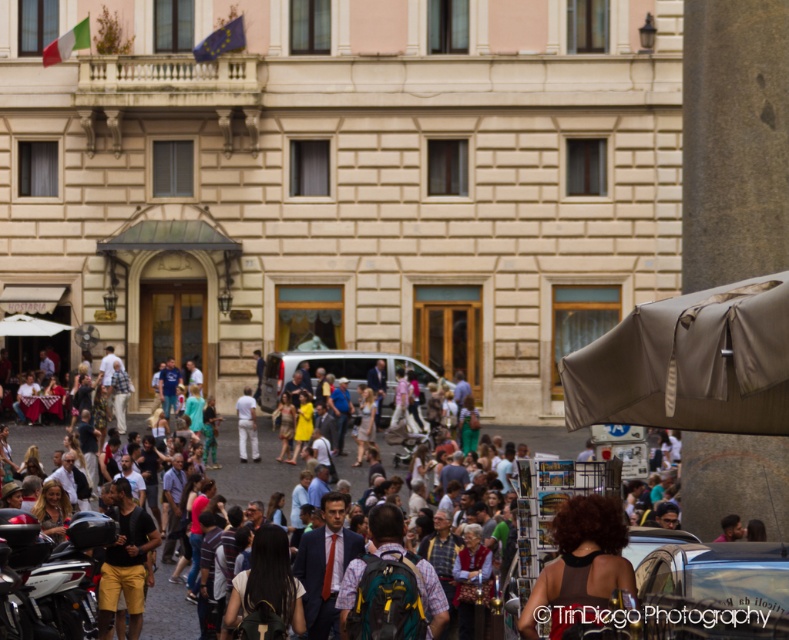
Consider the image. You are a photographer standing at the corner of the street, aiming to capture the entire beige stone building with classical design elements in your shot. There is a person wearing yellow shorts at center in the way. Based on their position, will they be in your photo?

The yellow shorts at center is located at point (x=125, y=561), which is within the frame of the photographer standing at the corner of the street. Therefore, the person wearing yellow shorts at center will be in the photo.

You are a photographer trying to capture a photo of the dark brown hair at center without including the silver metallic motorcycle at lower left in the frame. Based on their positions, is this possible?

The silver metallic motorcycle at lower left is to the left of dark brown hair at center, so if you position yourself to the right side of the motorcycle, you can capture the dark brown hair at center without including the motorcycle in the frame.